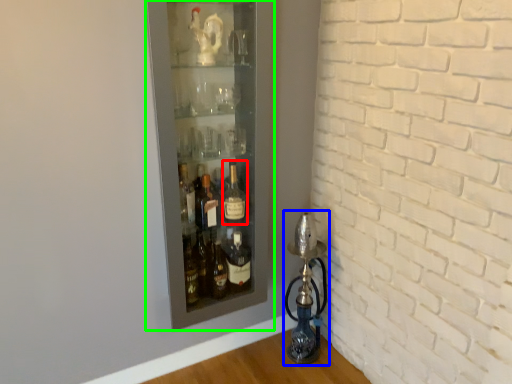
Question: Based on their relative distances, which object is farther from bottle (highlighted by a red box)? Choose from oil lamp (highlighted by a blue box) and shelf (highlighted by a green box).

Choices:
 (A) oil lamp
 (B) shelf

Answer: (A)